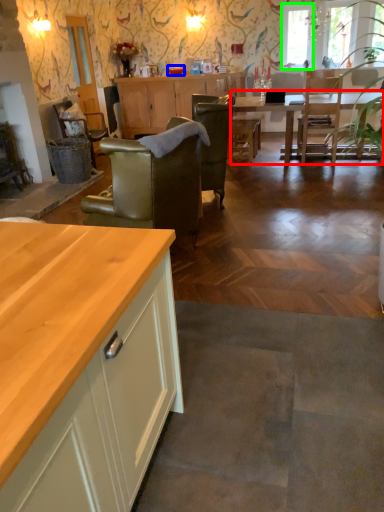
Question: Based on their relative distances, which object is farther from kitchen & dining room table (highlighted by a red box)? Choose from tableware (highlighted by a blue box) and window screen (highlighted by a green box).

Choices:
 (A) tableware
 (B) window screen

Answer: (A)